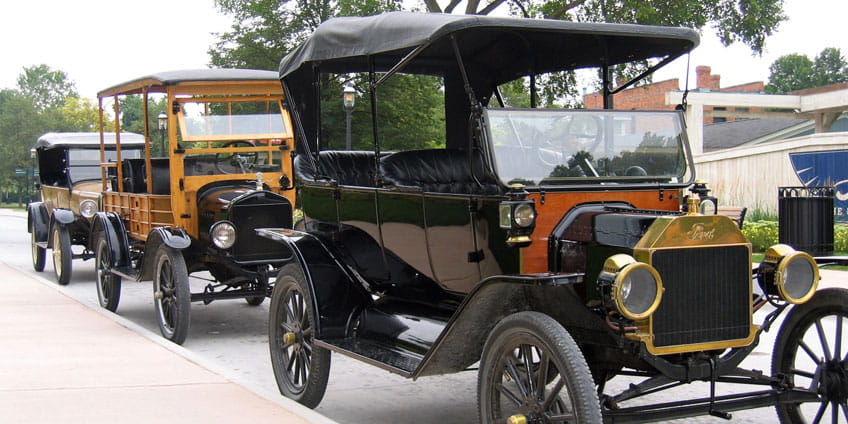
Identify the location of window. This screenshot has height=424, width=848. click(x=618, y=162).